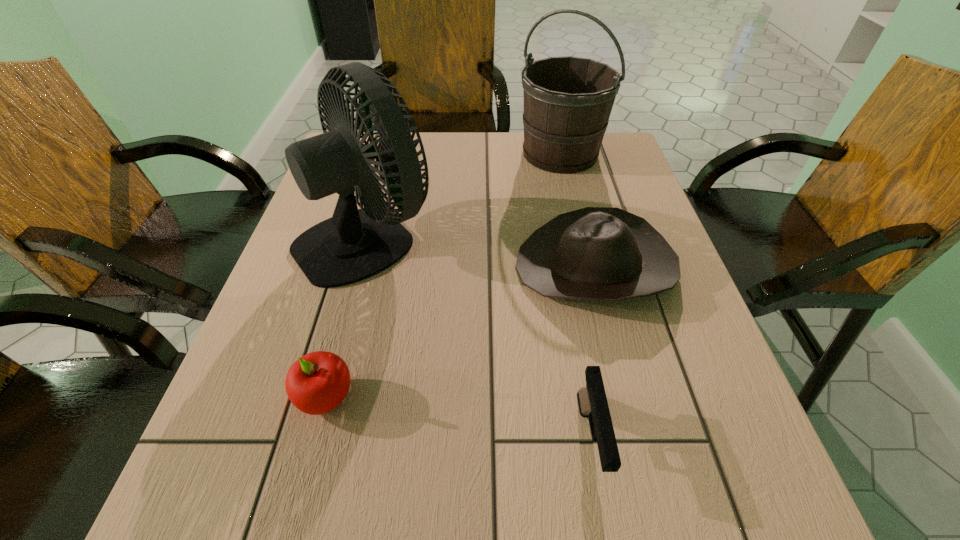
The height and width of the screenshot is (540, 960). What are the coordinates of `the farthest object` in the screenshot? It's located at (568, 100).

At what (x,y) coordinates should I click in order to perform the action: click on fan. Please return your answer as a coordinate pair (x, y). Looking at the image, I should click on (354, 244).

The width and height of the screenshot is (960, 540). Identify the location of cowboy hat. (595, 253).

You are a GUI agent. You are given a task and a screenshot of the screen. Output one action in this format:
    pyautogui.click(x=<x>, y=<y>)
    Task: Click on the apple
    Image resolution: width=960 pixels, height=540 pixels.
    Given the screenshot: What is the action you would take?
    316,383

I want to click on pistol, so click(x=592, y=401).

At what (x,y) coordinates should I click in order to perform the action: click on vacant space located on the left of the farthest object. Please return your answer as a coordinate pair (x, y). Looking at the image, I should click on (388, 153).

At what (x,y) coordinates should I click in order to perform the action: click on free space located in front of the fan to direct airflow. Please return your answer as a coordinate pair (x, y). This screenshot has width=960, height=540. Looking at the image, I should click on (586, 237).

Locate an element on the screen. This screenshot has height=540, width=960. free space located 0.280m on the left of the cowboy hat is located at coordinates (381, 267).

The width and height of the screenshot is (960, 540). Find the location of `vacant space situated 0.170m on the right of the apple`. vacant space situated 0.170m on the right of the apple is located at coordinates (460, 397).

Locate an element on the screen. vacant space located 0.050m on the front-facing side of the pistol is located at coordinates (607, 537).